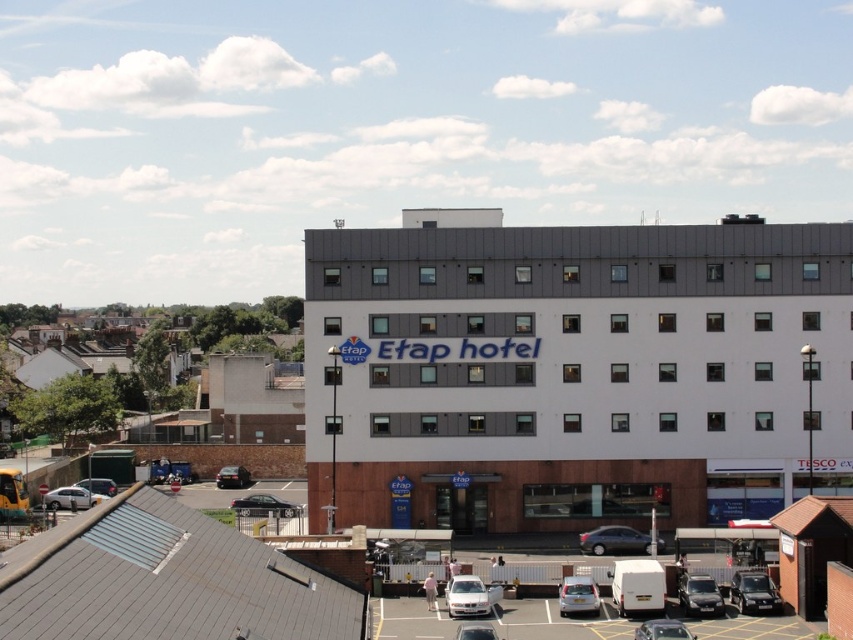
Question: Does silver metallic sedan at lower left appear on the left side of shiny silver car at center?

Choices:
 (A) no
 (B) yes

Answer: (B)

Question: Is metallic silver sedan at center smaller than silver metallic car at center?

Choices:
 (A) yes
 (B) no

Answer: (B)

Question: Among these objects, which one is nearest to the camera?

Choices:
 (A) silver metallic car at lower left
 (B) silver metallic car at center
 (C) silver metallic van at center
 (D) white matte etap hotel at center

Answer: (B)

Question: Which point appears farthest from the camera in this image?

Choices:
 (A) (49, 506)
 (B) (845, 317)
 (C) (223, 472)
 (D) (573, 612)

Answer: (C)

Question: Is white matte etap hotel at center positioned behind silver metallic car at lower left?

Choices:
 (A) yes
 (B) no

Answer: (B)

Question: Estimate the real-world distances between objects in this image. Which object is farther from the metallic gray sedan at center?

Choices:
 (A) silver metallic sedan at lower left
 (B) matte silver car at lower right
 (C) shiny silver car at center

Answer: (A)